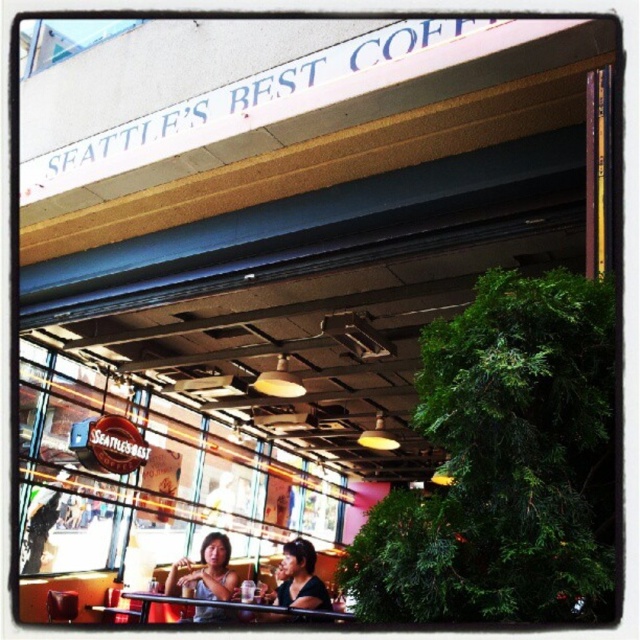
You are a customer looking at two people sitting inside Seattle Best Coffee through the window. You notice a matte white tank top at center and a matte black shirt at lower center. Which clothing item is located to the left of the other?

The matte white tank top at center is positioned on the left side of matte black shirt at lower center.